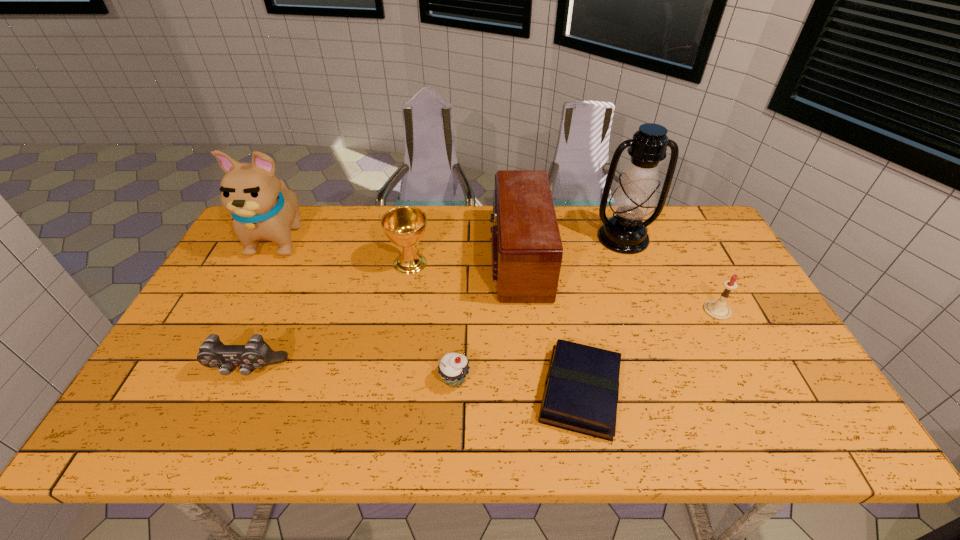
Locate an element on the screen. The width and height of the screenshot is (960, 540). free region located on the face of the puppy is located at coordinates (250, 295).

The image size is (960, 540). Identify the location of vacant space positioned 0.090m on the front-facing side of the sixth shortest object. pyautogui.click(x=461, y=258).

At what (x,y) coordinates should I click in order to perform the action: click on vacant space situated on the front-facing side of the sixth shortest object. Please return your answer as a coordinate pair (x, y). Looking at the image, I should click on (395, 258).

Find the location of a particular element. This screenshot has height=540, width=960. vacant space located 0.190m on the front-facing side of the sixth shortest object is located at coordinates (429, 258).

Locate an element on the screen. The width and height of the screenshot is (960, 540). free space located on the right of the chalice is located at coordinates (472, 263).

I want to click on free location located on the left of the candle, so click(x=643, y=310).

Find the location of a particular element. free point located on the surface of the control with buttons is located at coordinates (231, 407).

Find the location of a particular element. Image resolution: width=960 pixels, height=540 pixels. vacant space located 0.120m on the back of the cupcake is located at coordinates (457, 328).

At what (x,y) coordinates should I click in order to perform the action: click on vacant space located 0.370m on the back of the book. Please return your answer as a coordinate pair (x, y). This screenshot has width=960, height=540. Looking at the image, I should click on (555, 255).

Where is `oil lamp located in the far edge section of the desktop`? oil lamp located in the far edge section of the desktop is located at coordinates (634, 198).